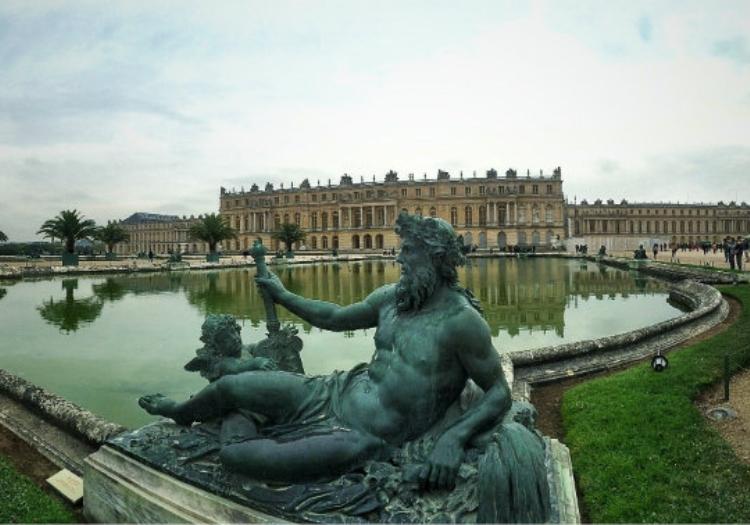
I want to click on concrete trim, so pyautogui.click(x=582, y=350).